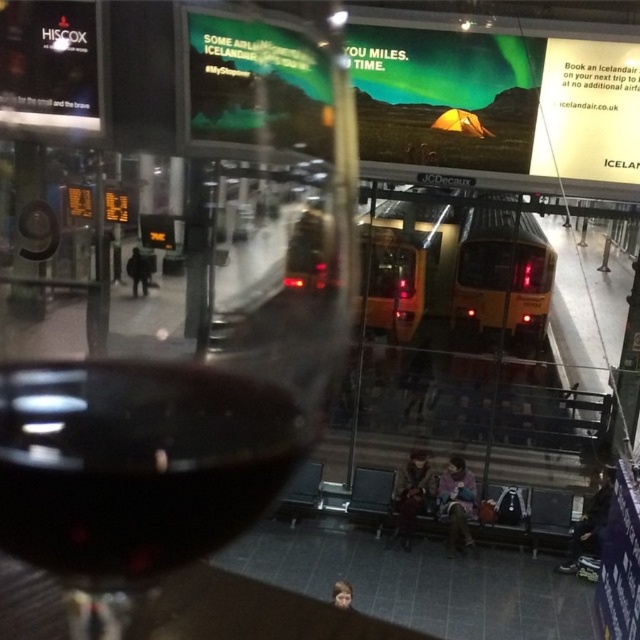
Question: In this image, where is opaque dark red wine at center located relative to dark glass wine at lower left?

Choices:
 (A) left
 (B) right

Answer: (A)

Question: Can you confirm if opaque dark red wine at center is thinner than dark glass wine at lower left?

Choices:
 (A) yes
 (B) no

Answer: (B)

Question: Which of the following is the closest to the observer?

Choices:
 (A) (260, 122)
 (B) (147, 387)

Answer: (B)

Question: Does opaque dark red wine at center have a smaller size compared to dark glass wine at lower left?

Choices:
 (A) no
 (B) yes

Answer: (A)

Question: Which point is closer to the camera?

Choices:
 (A) click(x=35, y=292)
 (B) click(x=17, y=499)

Answer: (B)